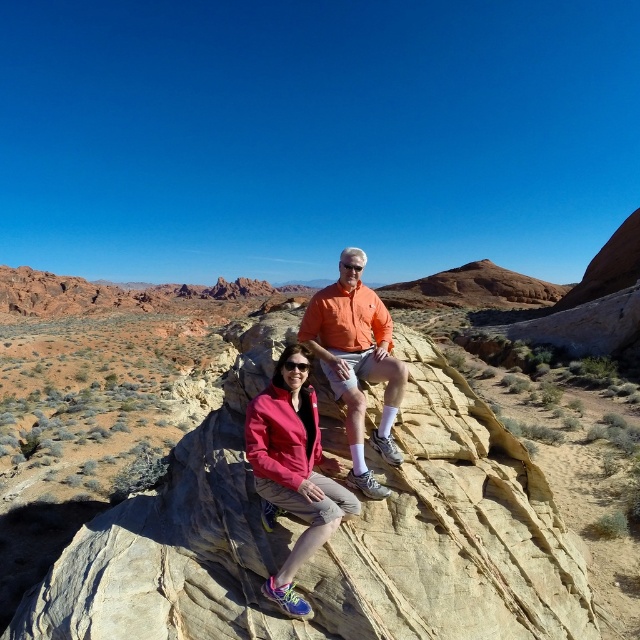
Can you confirm if smooth sandstone rock at center is positioned above orange cotton shirt at center?

Incorrect, smooth sandstone rock at center is not positioned above orange cotton shirt at center.

Is smooth sandstone rock at center taller than orange cotton shirt at center?

Yes.

You are a GUI agent. You are given a task and a screenshot of the screen. Output one action in this format:
    pyautogui.click(x=<x>, y=<y>)
    Task: Click on the smooth sandstone rock at center
    This screenshot has height=640, width=640.
    Given the screenshot: What is the action you would take?
    pyautogui.click(x=333, y=536)

Locate an element on the screen. smooth sandstone rock at center is located at coordinates (333, 536).

Does matte pink jacket at center appear on the right side of orange cotton shirt at center?

Incorrect, matte pink jacket at center is not on the right side of orange cotton shirt at center.

The height and width of the screenshot is (640, 640). Find the location of `matte pink jacket at center`. matte pink jacket at center is located at coordinates (292, 468).

Describe the element at coordinates (292, 468) in the screenshot. Image resolution: width=640 pixels, height=640 pixels. I see `matte pink jacket at center` at that location.

Locate an element on the screen. matte pink jacket at center is located at coordinates (292, 468).

Is smooth sandstone rock at center smaller than matte pink jacket at center?

Actually, smooth sandstone rock at center might be larger than matte pink jacket at center.

Is smooth sandstone rock at center thinner than matte pink jacket at center?

In fact, smooth sandstone rock at center might be wider than matte pink jacket at center.

At what (x,y) coordinates should I click in order to perform the action: click on smooth sandstone rock at center. Please return your answer as a coordinate pair (x, y). Looking at the image, I should click on (333, 536).

Where is `smooth sandstone rock at center`? Image resolution: width=640 pixels, height=640 pixels. smooth sandstone rock at center is located at coordinates (333, 536).